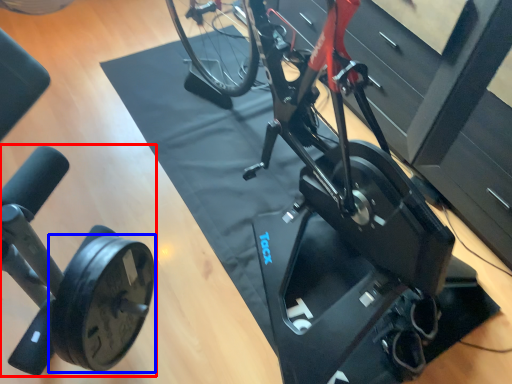
Question: Among these objects, which one is nearest to the camera, stationary bicycle (highlighted by a red box) or wheel (highlighted by a blue box)?

Choices:
 (A) stationary bicycle
 (B) wheel

Answer: (B)